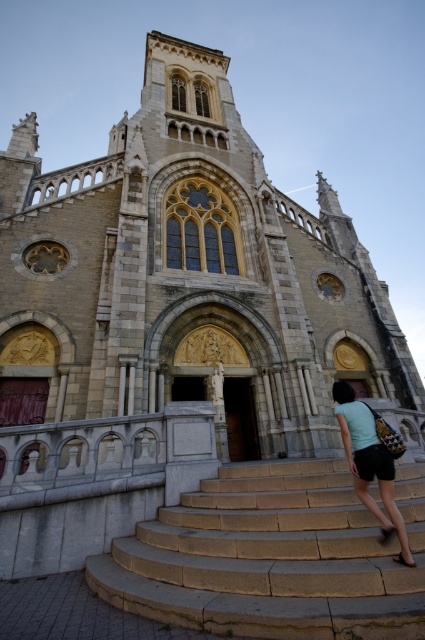
Between stone stairs at center and light blue fabric at center, which one has less height?

stone stairs at center

Does stone stairs at center have a greater height compared to light blue fabric at center?

No, stone stairs at center is not taller than light blue fabric at center.

Locate an element on the screen. stone stairs at center is located at coordinates (272, 557).